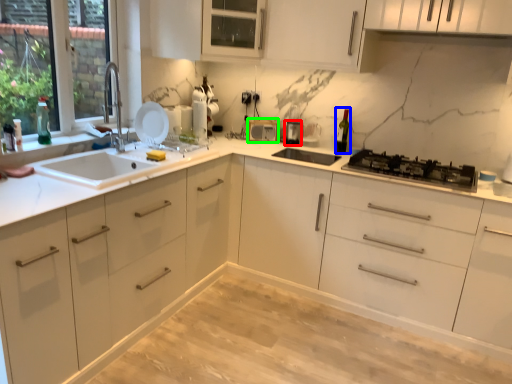
Question: Which object is positioned farthest from appliance (highlighted by a red box)? Select from wine bottle (highlighted by a blue box) and appliance (highlighted by a green box).

Choices:
 (A) wine bottle
 (B) appliance

Answer: (A)